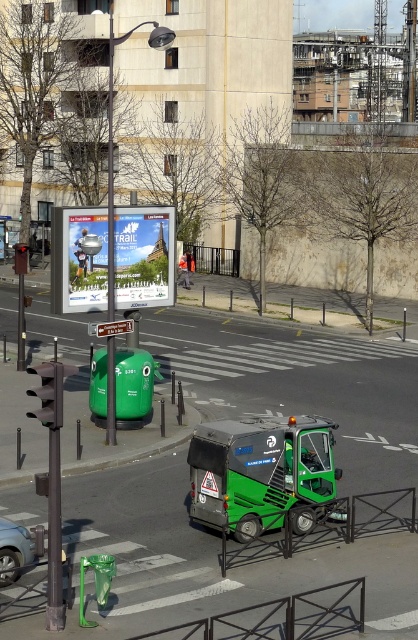
Question: Which object appears closest to the camera in this image?

Choices:
 (A) green matte garbage truck at center
 (B) matte white poster at center

Answer: (A)

Question: Which point is closer to the camera?

Choices:
 (A) metallic silver car at lower left
 (B) green matte garbage truck at center
 (C) matte white poster at center

Answer: (A)

Question: In this image, where is green matte garbage truck at center located relative to matte white poster at center?

Choices:
 (A) above
 (B) below

Answer: (B)

Question: In this image, where is matte white poster at center located relative to metallic silver car at lower left?

Choices:
 (A) left
 (B) right

Answer: (B)

Question: Which object is closer to the camera taking this photo?

Choices:
 (A) matte white poster at center
 (B) metallic silver car at lower left

Answer: (B)

Question: Can you confirm if green matte garbage truck at center is thinner than matte white poster at center?

Choices:
 (A) yes
 (B) no

Answer: (A)